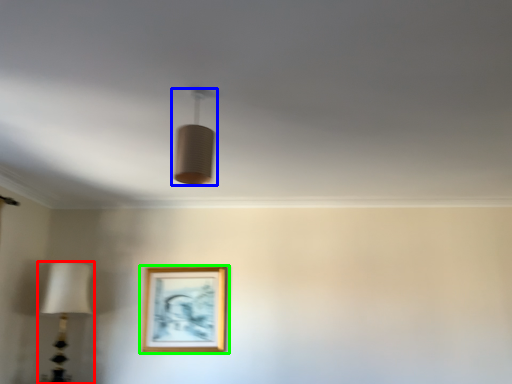
Question: Based on their relative distances, which object is farther from lamp (highlighted by a red box)? Choose from lamp (highlighted by a blue box) and picture frame (highlighted by a green box).

Choices:
 (A) lamp
 (B) picture frame

Answer: (A)